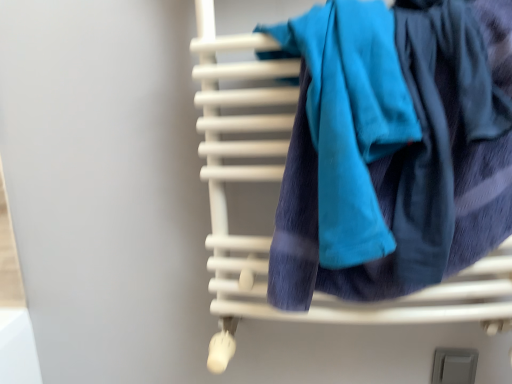
Question: Is teal soft towel at center smaller than white matte towel rack at center?

Choices:
 (A) yes
 (B) no

Answer: (A)

Question: Considering the relative positions of teal soft towel at center and white matte towel rack at center in the image provided, is teal soft towel at center behind white matte towel rack at center?

Choices:
 (A) yes
 (B) no

Answer: (B)

Question: Does teal soft towel at center appear on the left side of white matte towel rack at center?

Choices:
 (A) yes
 (B) no

Answer: (A)

Question: Could you tell me if teal soft towel at center is facing white matte towel rack at center?

Choices:
 (A) no
 (B) yes

Answer: (B)

Question: From a real-world perspective, is teal soft towel at center under white matte towel rack at center?

Choices:
 (A) no
 (B) yes

Answer: (A)

Question: Do you think white matte towel rack at center is within gray matte switch at lower right, or outside of it?

Choices:
 (A) inside
 (B) outside

Answer: (B)

Question: Considering the relative positions of white matte towel rack at center and gray matte switch at lower right in the image provided, is white matte towel rack at center to the left or to the right of gray matte switch at lower right?

Choices:
 (A) right
 (B) left

Answer: (B)

Question: In terms of width, does white matte towel rack at center look wider or thinner when compared to gray matte switch at lower right?

Choices:
 (A) wide
 (B) thin

Answer: (A)

Question: Is point (475, 203) positioned closer to the camera than point (471, 377)?

Choices:
 (A) closer
 (B) farther

Answer: (A)

Question: Is point (476, 354) positioned closer to the camera than point (359, 148)?

Choices:
 (A) farther
 (B) closer

Answer: (A)

Question: In the image, is gray matte switch at lower right positioned in front of or behind teal soft towel at center?

Choices:
 (A) front
 (B) behind

Answer: (B)

Question: From the image's perspective, is gray matte switch at lower right above or below teal soft towel at center?

Choices:
 (A) above
 (B) below

Answer: (B)

Question: Considering the positions of gray matte switch at lower right and teal soft towel at center in the image, is gray matte switch at lower right bigger or smaller than teal soft towel at center?

Choices:
 (A) small
 (B) big

Answer: (A)

Question: Is point (378, 64) positioned closer to the camera than point (231, 142)?

Choices:
 (A) farther
 (B) closer

Answer: (B)

Question: Considering the positions of teal soft towel at center and white matte towel rack at center in the image, is teal soft towel at center wider or thinner than white matte towel rack at center?

Choices:
 (A) thin
 (B) wide

Answer: (A)